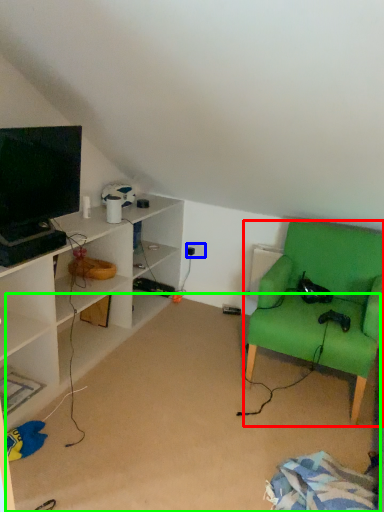
Question: Which object is the farthest from chair (highlighted by a red box)? Choose among these: electric outlet (highlighted by a blue box) or plain (highlighted by a green box).

Choices:
 (A) electric outlet
 (B) plain

Answer: (A)